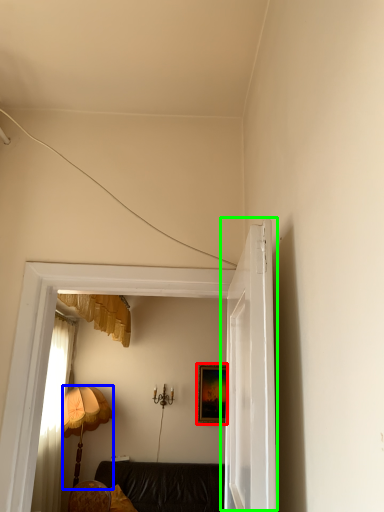
Question: Which object is the farthest from picture frame (highlighted by a red box)? Choose among these: lamp (highlighted by a blue box) or door (highlighted by a green box).

Choices:
 (A) lamp
 (B) door

Answer: (B)